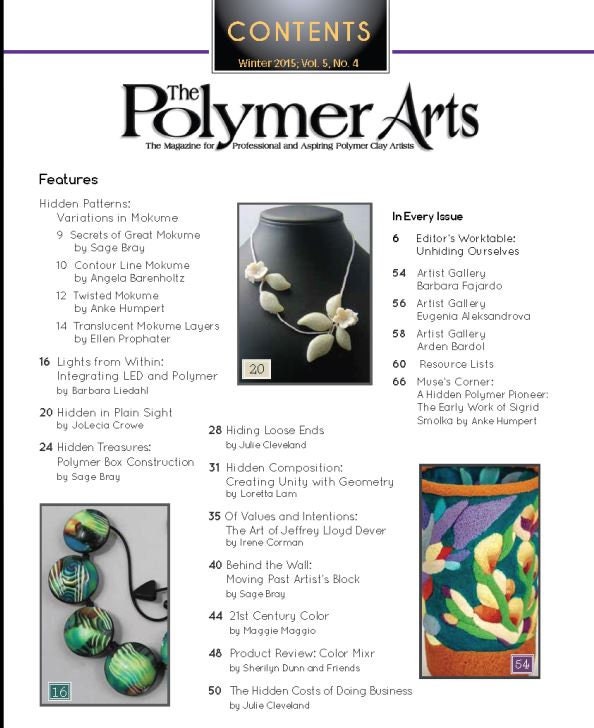
At what (x,y) coordinates should I click in order to perform the action: click on grey bust. Please return your answer as a coordinate pair (x, y). This screenshot has height=728, width=594. Looking at the image, I should click on (301, 237).